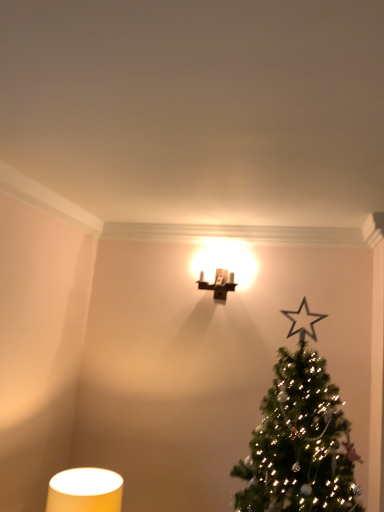
Identify the location of green matte christmas tree at upper right. The height and width of the screenshot is (512, 384). (300, 439).

What do you see at coordinates (219, 284) in the screenshot?
I see `matte brown wall sconce at upper center, placed as the 1th table lamp when sorted from back to front` at bounding box center [219, 284].

Locate an element on the screen. green matte christmas tree at upper right is located at coordinates (300, 439).

Identify the location of christmas tree located above the matte yellow cylindrical lampshade at lower left, arranged as the 1th table lamp when viewed from the front (from a real-world perspective). The height and width of the screenshot is (512, 384). (300, 439).

Is matte yellow cylindrical lampshade at lower left, acting as the 2th table lamp starting from the right, next to green matte christmas tree at upper right and touching it?

No, matte yellow cylindrical lampshade at lower left, acting as the 2th table lamp starting from the right, is not beside green matte christmas tree at upper right.

From the picture: From the image's perspective, is matte yellow cylindrical lampshade at lower left, which appears as the second table lamp when viewed from the top, above or below green matte christmas tree at upper right?

matte yellow cylindrical lampshade at lower left, which appears as the second table lamp when viewed from the top, is situated lower than green matte christmas tree at upper right in the image.

Is matte yellow cylindrical lampshade at lower left, acting as the 2th table lamp starting from the right, at the left side of green matte christmas tree at upper right?

Correct, you'll find matte yellow cylindrical lampshade at lower left, acting as the 2th table lamp starting from the right, to the left of green matte christmas tree at upper right.

Which is closer to the camera, (212, 289) or (118, 493)?

Point (212, 289) is farther from the camera than point (118, 493).

Can you tell me how much matte brown wall sconce at upper center, positioned as the second table lamp in left-to-right order, and matte yellow cylindrical lampshade at lower left, placed as the 1th table lamp when sorted from left to right, differ in facing direction?

The angle between the facing direction of matte brown wall sconce at upper center, positioned as the second table lamp in left-to-right order, and the facing direction of matte yellow cylindrical lampshade at lower left, placed as the 1th table lamp when sorted from left to right, is 2.46 degrees.

Can you see matte brown wall sconce at upper center, the 2th table lamp when ordered from bottom to top, touching matte yellow cylindrical lampshade at lower left, which appears as the second table lamp when viewed from the top?

There is a gap between matte brown wall sconce at upper center, the 2th table lamp when ordered from bottom to top, and matte yellow cylindrical lampshade at lower left, which appears as the second table lamp when viewed from the top.

Is matte brown wall sconce at upper center, the 2th table lamp when ordered from bottom to top, situated inside matte yellow cylindrical lampshade at lower left, placed as the 1th table lamp when sorted from left to right, or outside?

matte brown wall sconce at upper center, the 2th table lamp when ordered from bottom to top, is spatially situated outside matte yellow cylindrical lampshade at lower left, placed as the 1th table lamp when sorted from left to right.

Is matte yellow cylindrical lampshade at lower left, the 2th table lamp viewed from the back, situated inside matte brown wall sconce at upper center, marked as the first table lamp in a top-to-bottom arrangement, or outside?

→ matte yellow cylindrical lampshade at lower left, the 2th table lamp viewed from the back, is outside matte brown wall sconce at upper center, marked as the first table lamp in a top-to-bottom arrangement.

Where is `table lamp to the left of matte brown wall sconce at upper center, which is the second table lamp in front-to-back order`? table lamp to the left of matte brown wall sconce at upper center, which is the second table lamp in front-to-back order is located at coordinates (85, 490).

Which is nearer, (96, 474) or (205, 289)?

The point (96, 474) is more forward.

Looking at this image, from the image's perspective, which one is positioned higher, matte brown wall sconce at upper center, the 1th table lamp from the right, or green matte christmas tree at upper right?

matte brown wall sconce at upper center, the 1th table lamp from the right.

Consider the image. Could you tell me if matte brown wall sconce at upper center, placed as the 1th table lamp when sorted from back to front, is turned towards green matte christmas tree at upper right?

No, matte brown wall sconce at upper center, placed as the 1th table lamp when sorted from back to front, is not aimed at green matte christmas tree at upper right.

Looking at the image, does matte brown wall sconce at upper center, positioned as the second table lamp in left-to-right order, seem bigger or smaller compared to green matte christmas tree at upper right?

Clearly, matte brown wall sconce at upper center, positioned as the second table lamp in left-to-right order, is smaller in size than green matte christmas tree at upper right.

From the image's perspective, which object appears higher, green matte christmas tree at upper right or matte yellow cylindrical lampshade at lower left, the 2th table lamp viewed from the back?

From the image's view, green matte christmas tree at upper right is above.

Is green matte christmas tree at upper right positioned far away from matte yellow cylindrical lampshade at lower left, acting as the 2th table lamp starting from the right?

No, there isn't a large distance between green matte christmas tree at upper right and matte yellow cylindrical lampshade at lower left, acting as the 2th table lamp starting from the right.

Is green matte christmas tree at upper right taller or shorter than matte yellow cylindrical lampshade at lower left, the 2th table lamp viewed from the back?

green matte christmas tree at upper right is taller than matte yellow cylindrical lampshade at lower left, the 2th table lamp viewed from the back.

Which of these two, green matte christmas tree at upper right or matte brown wall sconce at upper center, the 1th table lamp from the right, stands taller?

green matte christmas tree at upper right.

Consider the image. From the image's perspective, is green matte christmas tree at upper right positioned above or below matte brown wall sconce at upper center, the 2th table lamp when ordered from bottom to top?

From the image's perspective, green matte christmas tree at upper right appears below matte brown wall sconce at upper center, the 2th table lamp when ordered from bottom to top.

Would you consider green matte christmas tree at upper right to be distant from matte brown wall sconce at upper center, the 2th table lamp when ordered from bottom to top?

green matte christmas tree at upper right is actually quite close to matte brown wall sconce at upper center, the 2th table lamp when ordered from bottom to top.

Find the location of a particular element. Image resolution: width=384 pixels, height=512 pixels. christmas tree above the matte yellow cylindrical lampshade at lower left, placed as the first table lamp when sorted from bottom to top (from the image's perspective) is located at coordinates (300, 439).

At what (x,y) coordinates should I click in order to perform the action: click on table lamp on the right of the matte yellow cylindrical lampshade at lower left, placed as the 1th table lamp when sorted from left to right. Please return your answer as a coordinate pair (x, y). Looking at the image, I should click on (219, 284).

Estimate the real-world distances between objects in this image. Which object is closer to matte brown wall sconce at upper center, positioned as the second table lamp in left-to-right order, green matte christmas tree at upper right or matte yellow cylindrical lampshade at lower left, acting as the 2th table lamp starting from the right?

green matte christmas tree at upper right is positioned closer to the anchor matte brown wall sconce at upper center, positioned as the second table lamp in left-to-right order.

From the image, which object appears to be farther from matte yellow cylindrical lampshade at lower left, the 2th table lamp viewed from the back, green matte christmas tree at upper right or matte brown wall sconce at upper center, which is the second table lamp in front-to-back order?

Among the two, matte brown wall sconce at upper center, which is the second table lamp in front-to-back order, is located further to matte yellow cylindrical lampshade at lower left, the 2th table lamp viewed from the back.

Based on their spatial positions, is matte yellow cylindrical lampshade at lower left, placed as the first table lamp when sorted from bottom to top, or matte brown wall sconce at upper center, the 1th table lamp from the right, further from green matte christmas tree at upper right?

matte brown wall sconce at upper center, the 1th table lamp from the right, is positioned further to the anchor green matte christmas tree at upper right.

Looking at the image, which one is located further to green matte christmas tree at upper right, matte brown wall sconce at upper center, which is the second table lamp in front-to-back order, or matte yellow cylindrical lampshade at lower left, placed as the first table lamp when sorted from bottom to top?

matte brown wall sconce at upper center, which is the second table lamp in front-to-back order, lies further to green matte christmas tree at upper right than the other object.

Estimate the real-world distances between objects in this image. Which object is further from matte yellow cylindrical lampshade at lower left, the 2th table lamp viewed from the back, matte brown wall sconce at upper center, the 2th table lamp when ordered from bottom to top, or green matte christmas tree at upper right?

Among the two, matte brown wall sconce at upper center, the 2th table lamp when ordered from bottom to top, is located further to matte yellow cylindrical lampshade at lower left, the 2th table lamp viewed from the back.

Which object lies nearer to the anchor point matte brown wall sconce at upper center, placed as the 1th table lamp when sorted from back to front, matte yellow cylindrical lampshade at lower left, placed as the first table lamp when sorted from bottom to top, or green matte christmas tree at upper right?

green matte christmas tree at upper right is closer to matte brown wall sconce at upper center, placed as the 1th table lamp when sorted from back to front.

The height and width of the screenshot is (512, 384). I want to click on table lamp between green matte christmas tree at upper right and matte brown wall sconce at upper center, the 1th table lamp from the right, along the z-axis, so pos(85,490).